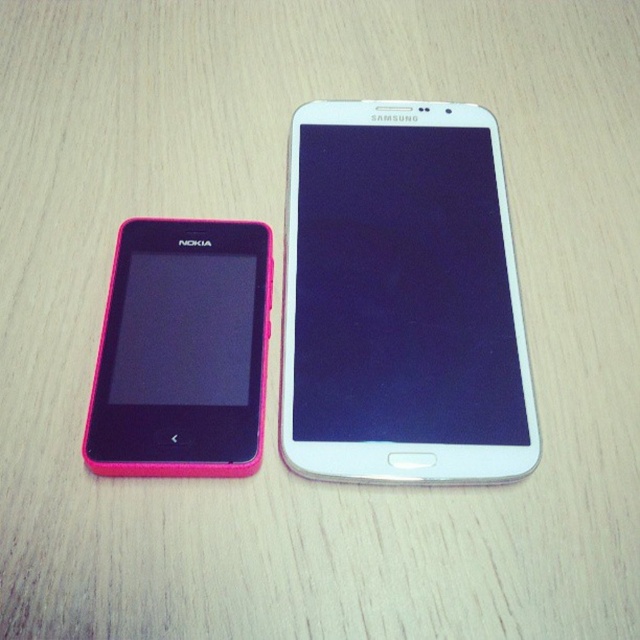
You are trying to locate the white glossy smartphone at center on a wooden table. Based on the coordinates given, where exactly should you look on the table?

The white glossy smartphone at center is located at the coordinates point (401,300) on the table.

You are trying to place both the white glossy smartphone at center and the pink plastic nokia phone at left into a protective case that can only accommodate the wider of the two. Based on the image, which phone should you choose for the case?

The white glossy smartphone at center might be wider than pink plastic nokia phone at left, so you should choose the white glossy smartphone at center for the case.

You are setting up a display for a tech exhibition and need to arrange the white glossy smartphone at center and the pink plastic nokia phone at left correctly. According to the image, which phone should be placed to the right of the other?

The white glossy smartphone at center should be placed to the right of the pink plastic nokia phone at left because the white glossy smartphone at center is positioned on the right side of pink plastic nokia phone at left in the image.